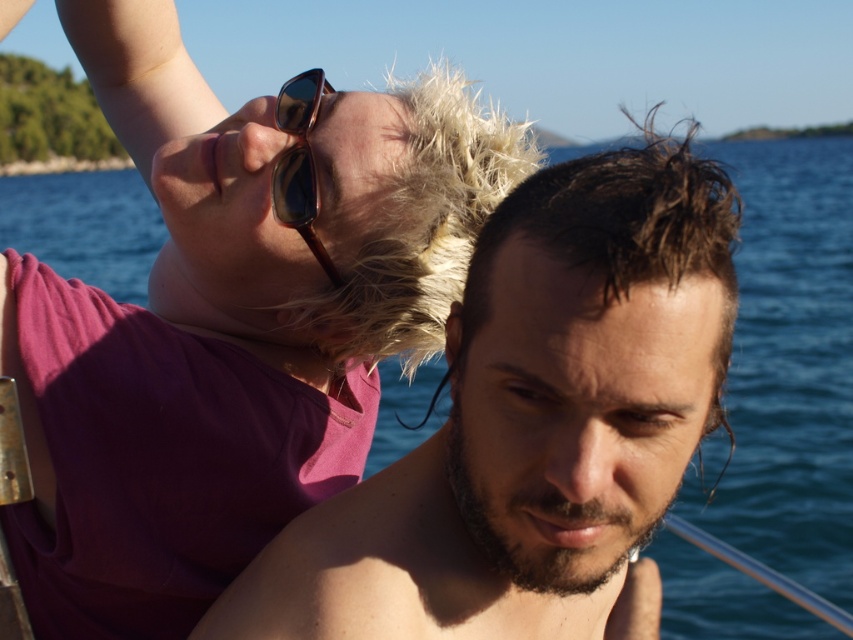
Question: Which of the following is the closest to the observer?

Choices:
 (A) (451, 208)
 (B) (300, 134)

Answer: (B)

Question: Is dark brown wet hair at center to the left of shiny brown sunglasses at upper center from the viewer's perspective?

Choices:
 (A) yes
 (B) no

Answer: (B)

Question: Which point is closer to the camera?

Choices:
 (A) dark brown wet hair at center
 (B) matte pink shirt at upper left

Answer: (A)

Question: Is matte pink shirt at upper left above dark brown wet hair at center?

Choices:
 (A) no
 (B) yes

Answer: (A)

Question: Observing the image, what is the correct spatial positioning of matte pink shirt at upper left in reference to shiny dark hair at center?

Choices:
 (A) left
 (B) right

Answer: (A)

Question: Among these objects, which one is farthest from the camera?

Choices:
 (A) matte pink shirt at upper left
 (B) shiny brown sunglasses at upper center

Answer: (B)